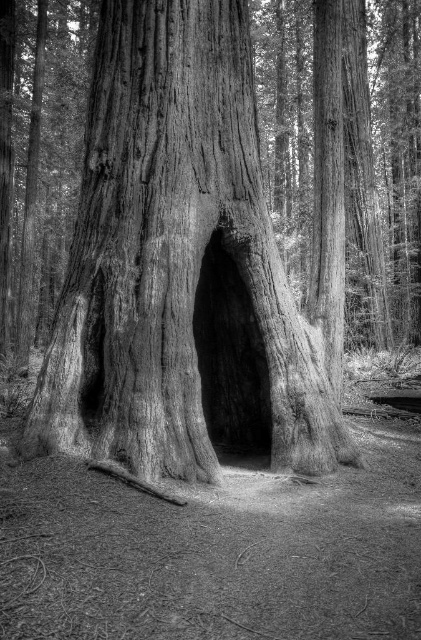
Question: Does grainy wood tree trunk at center lie behind smooth wood hole at center?

Choices:
 (A) yes
 (B) no

Answer: (B)

Question: Which of the following is the closest to the observer?

Choices:
 (A) (39, 420)
 (B) (229, 340)

Answer: (A)

Question: Among these points, which one is nearest to the camera?

Choices:
 (A) (216, 284)
 (B) (79, 371)

Answer: (B)

Question: Can you confirm if grainy wood tree trunk at center is positioned below smooth wood hole at center?

Choices:
 (A) yes
 (B) no

Answer: (B)

Question: From the image, what is the correct spatial relationship of grainy wood tree trunk at center in relation to smooth wood hole at center?

Choices:
 (A) above
 (B) below

Answer: (A)

Question: Which point is closer to the camera?

Choices:
 (A) (287, 467)
 (B) (199, 324)

Answer: (A)